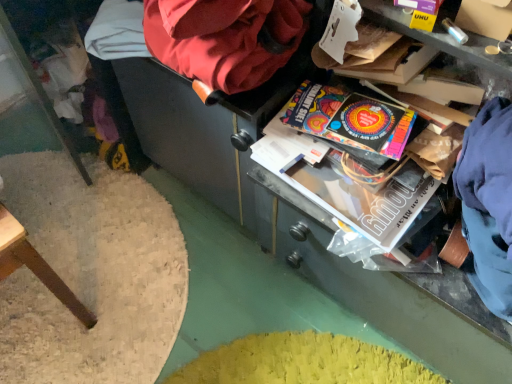
The height and width of the screenshot is (384, 512). What do you see at coordinates (225, 38) in the screenshot? I see `velvet-like red bean bag chair at upper center` at bounding box center [225, 38].

Find the location of a particular element. This screenshot has width=512, height=384. velvet-like red bean bag chair at upper center is located at coordinates (225, 38).

In order to face vibrant paper at center, should I rotate leftwards or rightwards?

A 14.082 degree turn to the right will do.

What do you see at coordinates (350, 119) in the screenshot? I see `vibrant paper at center` at bounding box center [350, 119].

Where is `vibrant paper at center`? The image size is (512, 384). vibrant paper at center is located at coordinates (350, 119).

Measure the distance between point [357,110] and camera.

Point [357,110] and camera are 28.94 inches apart from each other.

The image size is (512, 384). Identify the location of velvet-like red bean bag chair at upper center. (225, 38).

Between vibrant paper at center and velvet-like red bean bag chair at upper center, which one appears on the left side from the viewer's perspective?

velvet-like red bean bag chair at upper center.

Is vibrant paper at center further to the viewer compared to velvet-like red bean bag chair at upper center?

Yes, it is behind velvet-like red bean bag chair at upper center.

Between point (345, 140) and point (225, 35), which one is positioned in front?

The point (225, 35) is in front.

From the image's perspective, is vibrant paper at center located above or below velvet-like red bean bag chair at upper center?

vibrant paper at center is situated lower than velvet-like red bean bag chair at upper center in the image.

In the scene shown: From a real-world perspective, is vibrant paper at center positioned over velvet-like red bean bag chair at upper center based on gravity?

Actually, vibrant paper at center is physically below velvet-like red bean bag chair at upper center in the real world.

Does vibrant paper at center have a lesser width compared to velvet-like red bean bag chair at upper center?

Correct, the width of vibrant paper at center is less than that of velvet-like red bean bag chair at upper center.

Is vibrant paper at center taller than velvet-like red bean bag chair at upper center?

No.

Is vibrant paper at center bigger than velvet-like red bean bag chair at upper center?

Actually, vibrant paper at center might be smaller than velvet-like red bean bag chair at upper center.

Would you say vibrant paper at center is inside or outside velvet-like red bean bag chair at upper center?

vibrant paper at center is not enclosed by velvet-like red bean bag chair at upper center.

Is there a large distance between vibrant paper at center and velvet-like red bean bag chair at upper center?

They are positioned close to each other.

Is vibrant paper at center oriented towards velvet-like red bean bag chair at upper center?

No.

Locate an element on the screen. This screenshot has width=512, height=384. bean bag chair on the left of vibrant paper at center is located at coordinates (225, 38).

In the scene shown: Which is more to the left, velvet-like red bean bag chair at upper center or vibrant paper at center?

velvet-like red bean bag chair at upper center.

Is velvet-like red bean bag chair at upper center closer to the viewer compared to vibrant paper at center?

Yes, it is in front of vibrant paper at center.

Is point (244, 49) positioned before point (387, 153)?

That is True.

From the image's perspective, is velvet-like red bean bag chair at upper center located above or below vibrant paper at center?

Clearly, from the image's perspective, velvet-like red bean bag chair at upper center is above vibrant paper at center.

From a real-world perspective, is velvet-like red bean bag chair at upper center positioned above or below vibrant paper at center?

velvet-like red bean bag chair at upper center is situated higher than vibrant paper at center in the real world.

Considering the sizes of velvet-like red bean bag chair at upper center and vibrant paper at center in the image, is velvet-like red bean bag chair at upper center wider or thinner than vibrant paper at center?

velvet-like red bean bag chair at upper center is wider than vibrant paper at center.

Based on the photo, considering the relative sizes of velvet-like red bean bag chair at upper center and vibrant paper at center in the image provided, is velvet-like red bean bag chair at upper center shorter than vibrant paper at center?

Incorrect, the height of velvet-like red bean bag chair at upper center does not fall short of that of vibrant paper at center.

Considering the relative sizes of velvet-like red bean bag chair at upper center and vibrant paper at center in the image provided, is velvet-like red bean bag chair at upper center bigger than vibrant paper at center?

Yes.

Is velvet-like red bean bag chair at upper center not within vibrant paper at center?

Indeed, velvet-like red bean bag chair at upper center is completely outside vibrant paper at center.

Looking at this image, would you say velvet-like red bean bag chair at upper center is a long distance from vibrant paper at center?

No, velvet-like red bean bag chair at upper center is in close proximity to vibrant paper at center.

Based on the photo, is velvet-like red bean bag chair at upper center positioned with its back to vibrant paper at center?

That's not correct — velvet-like red bean bag chair at upper center is not looking away from vibrant paper at center.

How distant is velvet-like red bean bag chair at upper center from vibrant paper at center?

The distance of velvet-like red bean bag chair at upper center from vibrant paper at center is 6.53 inches.

Identify the location of paperback book on the right of the velvet-like red bean bag chair at upper center. (350, 119).

In order to click on bean bag chair lying in front of the vibrant paper at center in this screenshot , I will do tap(225, 38).

Where is `bean bag chair above the vibrant paper at center (from a real-world perspective)`? bean bag chair above the vibrant paper at center (from a real-world perspective) is located at coordinates (225, 38).